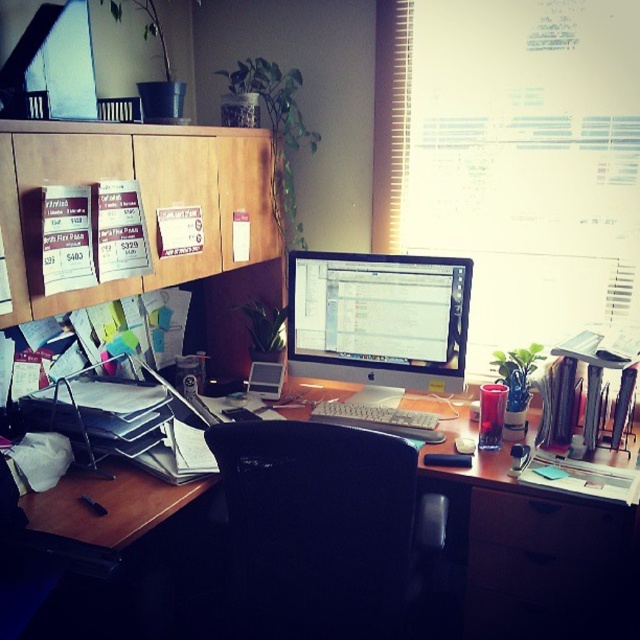
Question: Which point is farther to the camera?

Choices:
 (A) (320, 260)
 (B) (492, 509)
 (C) (477, 520)

Answer: (A)

Question: Is wooden desk at center wider than satin black monitor at center?

Choices:
 (A) no
 (B) yes

Answer: (B)

Question: Which object is positioned farthest from the satin black monitor at center?

Choices:
 (A) black plastic drawer at lower right
 (B) wooden desk at center

Answer: (A)

Question: Does wooden desk at center lie behind black plastic drawer at lower right?

Choices:
 (A) no
 (B) yes

Answer: (A)

Question: Which point is closer to the camera?

Choices:
 (A) wooden desk at center
 (B) black plastic drawer at lower right
 (C) satin black monitor at center

Answer: (A)

Question: Is wooden desk at center positioned at the back of satin black monitor at center?

Choices:
 (A) no
 (B) yes

Answer: (A)